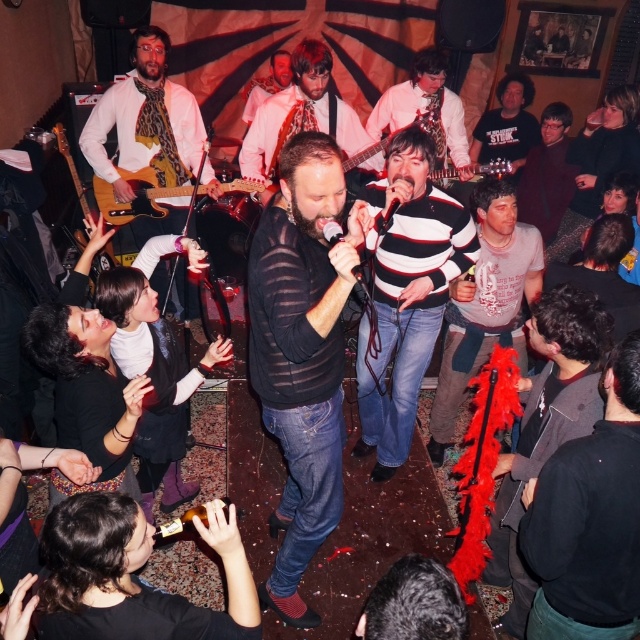
Question: Observing the image, what is the correct spatial positioning of dark gray textured jacket at center in reference to white shirt with red tie at center?

Choices:
 (A) right
 (B) left

Answer: (A)

Question: Among these points, which one is nearest to the camera?

Choices:
 (A) (406, 360)
 (B) (291, 58)

Answer: (A)

Question: Which point appears closest to the camera in this image?

Choices:
 (A) coord(227,186)
 (B) coord(490,116)
 (C) coord(259,166)
 (D) coord(364,280)

Answer: (D)

Question: From the image, what is the correct spatial relationship of dark gray sweater at upper right in relation to black matte microphone at center?

Choices:
 (A) below
 (B) above

Answer: (B)

Question: Is light brown wood electric guitar at upper left smaller than black matte microphone at center?

Choices:
 (A) yes
 (B) no

Answer: (B)

Question: Which object is closer to the camera taking this photo?

Choices:
 (A) light brown wood electric guitar at upper left
 (B) leopard print scarf at left
 (C) black sheer shirt at center
 (D) striped sweater at center

Answer: (C)